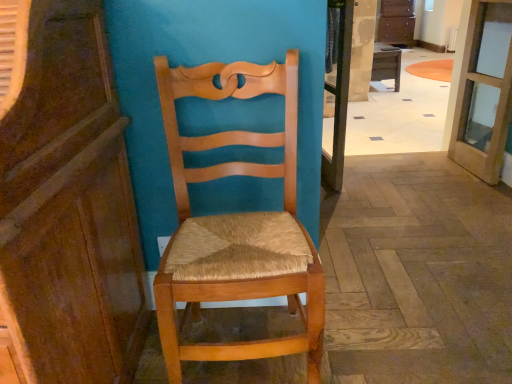
Measure the distance between wooden desk at center and camera.

wooden desk at center is 6.95 meters from camera.

This screenshot has height=384, width=512. Find the location of `wooden cabinet at left`. wooden cabinet at left is located at coordinates tap(69, 207).

Measure the distance between polished wood floor at center and camera.

polished wood floor at center and camera are 8.51 meters apart from each other.

In order to face polished wood floor at center, should I rotate leftwards or rightwards?

Turn right by 19.391 degrees to look at polished wood floor at center.

This screenshot has width=512, height=384. Describe the element at coordinates (484, 91) in the screenshot. I see `clear glass door at upper right` at that location.

Locate an element on the screen. The image size is (512, 384). wooden woven seat chair at center is located at coordinates (237, 224).

Which object is further away from the camera taking this photo, clear glass screen door at center or clear glass door at upper right?

Positioned behind is clear glass screen door at center.

Is clear glass screen door at center positioned with its back to clear glass door at upper right?

No, clear glass screen door at center's orientation is not away from clear glass door at upper right.

The width and height of the screenshot is (512, 384). What are the coordinates of `door on the right of clear glass screen door at center` in the screenshot? It's located at (484, 91).

Is wooden desk at center looking in the opposite direction of polished wood floor at center?

wooden desk at center does not have its back to polished wood floor at center.

Image resolution: width=512 pixels, height=384 pixels. Identify the location of corridor that appears above the wooden desk at center (from a real-world perspective). tap(405, 111).

Considering the positions of objects wooden desk at center and polished wood floor at center in the image provided, who is more to the left, wooden desk at center or polished wood floor at center?

polished wood floor at center.

From a real-world perspective, is clear glass door at upper right physically below wooden woven seat chair at center?

No, from a real-world perspective, clear glass door at upper right is not beneath wooden woven seat chair at center.

Measure the distance from clear glass door at upper right to wooden woven seat chair at center.

A distance of 6.27 feet exists between clear glass door at upper right and wooden woven seat chair at center.

Is clear glass door at upper right not near wooden woven seat chair at center?

Yes, clear glass door at upper right is far from wooden woven seat chair at center.

Who is more distant, clear glass door at upper right or wooden woven seat chair at center?

Positioned behind is clear glass door at upper right.

Is clear glass door at upper right at the left side of polished wood floor at center?

In fact, clear glass door at upper right is to the right of polished wood floor at center.

Measure the distance from clear glass door at upper right to polished wood floor at center.

clear glass door at upper right and polished wood floor at center are 7.23 meters apart from each other.

Is clear glass door at upper right not close to polished wood floor at center?

Yes.

Is point (484, 56) in front of point (426, 123)?

Yes.

From a real-world perspective, between polished wood floor at center and wooden desk at center, who is vertically higher?

From a 3D spatial view, polished wood floor at center is above.

Considering the positions of objects polished wood floor at center and wooden desk at center in the image provided, who is more to the right, polished wood floor at center or wooden desk at center?

From the viewer's perspective, wooden desk at center appears more on the right side.

Looking at their sizes, would you say polished wood floor at center is wider or thinner than wooden desk at center?

Clearly, polished wood floor at center has less width compared to wooden desk at center.

Is polished wood floor at center outside of wooden desk at center?

Yes, polished wood floor at center is outside of wooden desk at center.

Is wooden cabinet at left facing towards clear glass screen door at center?

No, wooden cabinet at left does not turn towards clear glass screen door at center.

In terms of width, does wooden cabinet at left look wider or thinner when compared to clear glass screen door at center?

Considering their sizes, wooden cabinet at left looks broader than clear glass screen door at center.

Does point (100, 140) appear closer or farther from the camera than point (335, 177)?

Clearly, point (100, 140) is closer to the camera than point (335, 177).

How far apart are wooden cabinet at left and clear glass screen door at center?

wooden cabinet at left is 5.55 feet away from clear glass screen door at center.

Can you see polished wood floor at center touching clear glass screen door at center?

No, polished wood floor at center is not beside clear glass screen door at center.

Can clear glass screen door at center be found inside polished wood floor at center?

Definitely not — clear glass screen door at center is not inside polished wood floor at center.

Which is behind, point (408, 90) or point (322, 162)?

The point (408, 90) is more distant.

Find the location of a particular element. screen door below the polished wood floor at center (from a real-world perspective) is located at coordinates (339, 96).

Identify the location of door on the right side of clear glass screen door at center. The width and height of the screenshot is (512, 384). (484, 91).

I want to click on desk lying behind the polished wood floor at center, so click(x=386, y=63).

Looking at the image, which one is located further to clear glass door at upper right, wooden woven seat chair at center or clear glass screen door at center?

wooden woven seat chair at center is further to clear glass door at upper right.

Estimate the real-world distances between objects in this image. Which object is closer to wooden desk at center, clear glass door at upper right or polished wood floor at center?

polished wood floor at center is positioned closer to the anchor wooden desk at center.

From the image, which object appears to be nearer to wooden cabinet at left, clear glass door at upper right or polished wood floor at center?

clear glass door at upper right lies closer to wooden cabinet at left than the other object.

When comparing their distances from wooden cabinet at left, does polished wood floor at center or wooden desk at center seem closer?

Based on the image, wooden desk at center appears to be nearer to wooden cabinet at left.

From the image, which object appears to be nearer to wooden desk at center, polished wood floor at center or wooden woven seat chair at center?

polished wood floor at center is positioned closer to the anchor wooden desk at center.

From the image, which object appears to be farther from wooden woven seat chair at center, polished wood floor at center or clear glass door at upper right?

polished wood floor at center is positioned further to the anchor wooden woven seat chair at center.

From the image, which object appears to be nearer to clear glass screen door at center, wooden desk at center or wooden woven seat chair at center?

wooden woven seat chair at center is closer to clear glass screen door at center.

Estimate the real-world distances between objects in this image. Which object is closer to polished wood floor at center, clear glass door at upper right or wooden woven seat chair at center?

clear glass door at upper right is positioned closer to the anchor polished wood floor at center.

Find the location of a particular element. This screenshot has height=384, width=512. screen door positioned between wooden cabinet at left and polished wood floor at center from near to far is located at coordinates [339, 96].

Find the location of a particular element. Image resolution: width=512 pixels, height=384 pixels. screen door located between wooden woven seat chair at center and polished wood floor at center in the depth direction is located at coordinates [339, 96].

Identify the location of door between wooden woven seat chair at center and wooden desk at center along the z-axis. pos(484,91).

At what (x,y) coordinates should I click in order to perform the action: click on corridor between wooden cabinet at left and wooden desk at center from front to back. Please return your answer as a coordinate pair (x, y). The height and width of the screenshot is (384, 512). Looking at the image, I should click on (405, 111).